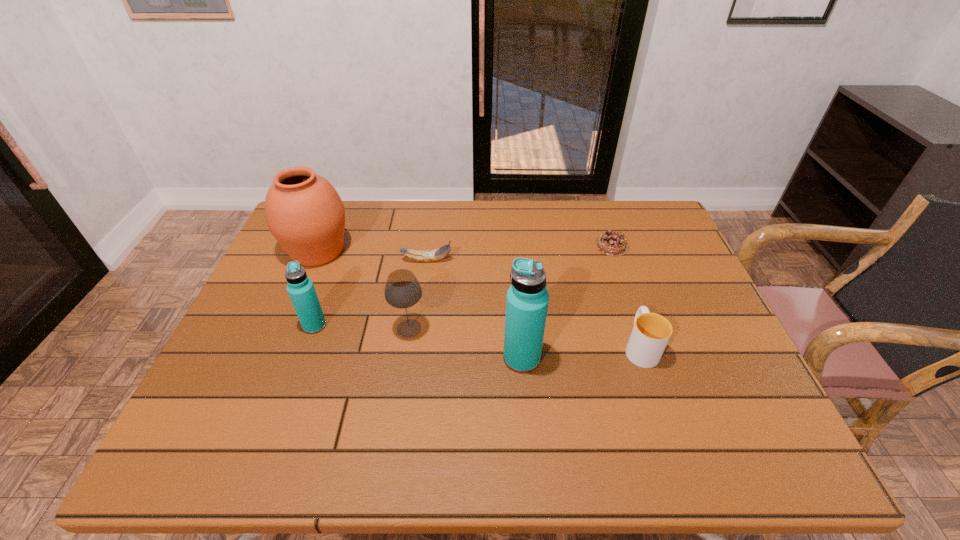
The width and height of the screenshot is (960, 540). Find the location of `free space between the taller water bottle and the left water bottle`. free space between the taller water bottle and the left water bottle is located at coordinates (419, 342).

Find the location of a particular element. This screenshot has height=540, width=960. free spot between the right water bottle and the cup is located at coordinates (581, 353).

At what (x,y) coordinates should I click in order to perform the action: click on vacant region between the shortest object and the farther water bottle. Please return your answer as a coordinate pair (x, y). The width and height of the screenshot is (960, 540). Looking at the image, I should click on (464, 286).

Where is `vacant area between the shorter water bottle and the cup`? vacant area between the shorter water bottle and the cup is located at coordinates (477, 336).

Locate an element on the screen. vacant point located between the banana and the second tallest object is located at coordinates (372, 255).

This screenshot has height=540, width=960. I want to click on vacant area between the shorter water bottle and the fifth object from left to right, so click(419, 342).

Where is `free space between the chocolate cake and the fifth tallest object`? The width and height of the screenshot is (960, 540). free space between the chocolate cake and the fifth tallest object is located at coordinates (626, 296).

Locate an element on the screen. This screenshot has width=960, height=540. the fifth closest object to the taller water bottle is located at coordinates (301, 290).

Identify which object is the sixth nearest to the fifth tallest object. Please provide its 2D coordinates. Your answer should be formatted as a tuple, i.e. [(x, y)], where the tuple contains the x and y coordinates of a point satisfying the conditions above.

[(303, 211)]

The image size is (960, 540). What are the coordinates of `free space in the image that satisfies the following two spatial constraints: 1. on the back side of the nearer water bottle; 2. on the left side of the shortest object` in the screenshot? It's located at (513, 246).